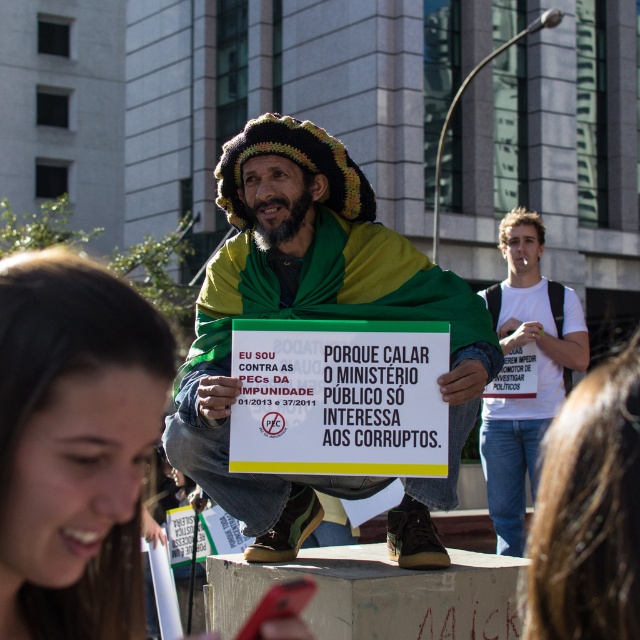
Question: Considering the relative positions of white t-shirt at center and white cotton t-shirt at upper right in the image provided, where is white t-shirt at center located with respect to white cotton t-shirt at upper right?

Choices:
 (A) below
 (B) above

Answer: (A)

Question: Based on their relative distances, which object is farther from the white t-shirt at center?

Choices:
 (A) green/yellow fabric draped at center
 (B) brown hair at lower left

Answer: (B)

Question: Estimate the real-world distances between objects in this image. Which object is closer to the white t-shirt at center?

Choices:
 (A) white cotton t-shirt at upper right
 (B) brown hair at lower left

Answer: (A)

Question: Can you confirm if white t-shirt at center is smaller than white cotton t-shirt at upper right?

Choices:
 (A) no
 (B) yes

Answer: (A)

Question: Is green/yellow fabric draped at center positioned at the back of white t-shirt at center?

Choices:
 (A) no
 (B) yes

Answer: (B)

Question: Which point is farther from the camera taking this photo?

Choices:
 (A) (518, 529)
 (B) (81, 372)
 (C) (256, 557)
 (D) (595, 419)

Answer: (A)